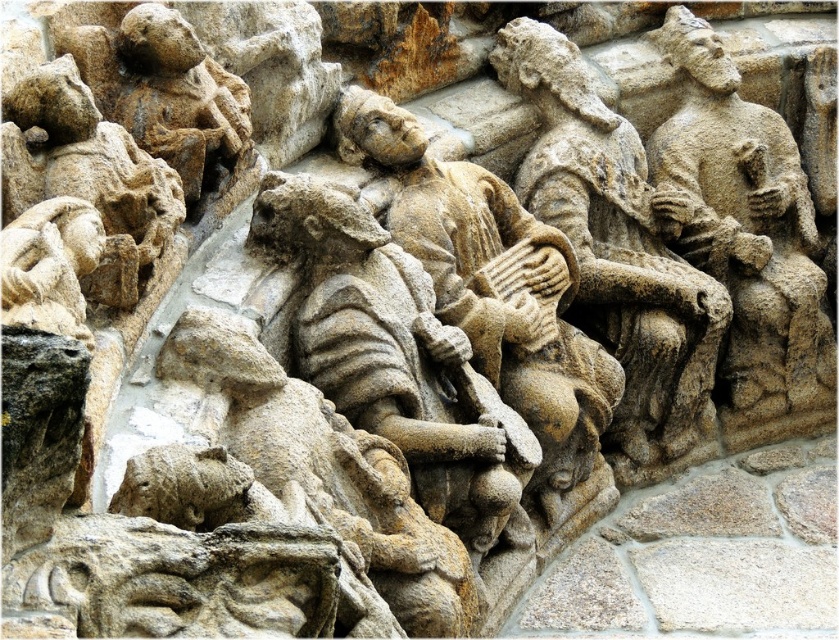
Question: Which object is farther from the camera taking this photo?

Choices:
 (A) stone figure at center
 (B) sandstone figure at right

Answer: (B)

Question: Does stone figure at center have a smaller size compared to sandstone figure at right?

Choices:
 (A) yes
 (B) no

Answer: (A)

Question: Can you confirm if stone figure at center is wider than sandstone figure at right?

Choices:
 (A) yes
 (B) no

Answer: (B)

Question: Which of the following is the farthest from the observer?

Choices:
 (A) (701, 212)
 (B) (322, 310)

Answer: (A)

Question: Which object appears farthest from the camera in this image?

Choices:
 (A) stone figure at center
 (B) sandstone figure at right

Answer: (B)

Question: Observing the image, what is the correct spatial positioning of stone figure at center in reference to sandstone figure at right?

Choices:
 (A) left
 (B) right

Answer: (A)